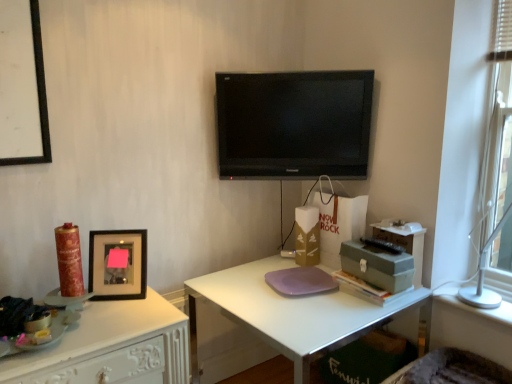
The width and height of the screenshot is (512, 384). What do you see at coordinates (294, 124) in the screenshot?
I see `black glossy flat-screen tv at center` at bounding box center [294, 124].

Image resolution: width=512 pixels, height=384 pixels. What do you see at coordinates (377, 265) in the screenshot? I see `matte green box at right, the second box positioned from the right` at bounding box center [377, 265].

At what (x,y) coordinates should I click in order to perform the action: click on black matte picture frame at upper left. Please return your answer as a coordinate pair (x, y). The width and height of the screenshot is (512, 384). Looking at the image, I should click on (118, 264).

From the picture: Is hardcover book at right thinner than white glossy desk at left, placed as the 2th desk when sorted from right to left?

Yes, hardcover book at right is thinner than white glossy desk at left, placed as the 2th desk when sorted from right to left.

Is hardcover book at right not close to white glossy desk at left, placed as the 2th desk when sorted from right to left?

hardcover book at right is near white glossy desk at left, placed as the 2th desk when sorted from right to left, not far away.

Is hardcover book at right located outside white glossy desk at left, placed as the 2th desk when sorted from right to left?

That's correct, hardcover book at right is outside of white glossy desk at left, placed as the 2th desk when sorted from right to left.

From their relative heights in the image, would you say white matte desk at center, positioned as the 1th desk in right-to-left order, is taller or shorter than fuzzy fabric swivel chair at lower right?

white matte desk at center, positioned as the 1th desk in right-to-left order, is taller than fuzzy fabric swivel chair at lower right.

From a real-world perspective, who is located higher, white matte desk at center, the second desk from the left, or fuzzy fabric swivel chair at lower right?

From a 3D spatial view, fuzzy fabric swivel chair at lower right is above.

Looking at this image, would you consider white matte desk at center, positioned as the 1th desk in right-to-left order, to be distant from fuzzy fabric swivel chair at lower right?

white matte desk at center, positioned as the 1th desk in right-to-left order, is near fuzzy fabric swivel chair at lower right, not far away.

How many degrees apart are the facing directions of black matte picture frame at upper left and hardcover book at right?

The angle between the facing direction of black matte picture frame at upper left and the facing direction of hardcover book at right is 53.7 degrees.

Is black matte picture frame at upper left at the left side of hardcover book at right?

Yes.

From the image's perspective, between black matte picture frame at upper left and hardcover book at right, which one is located above?

From the image's view, black matte picture frame at upper left is above.

Consider the image. From the image's perspective, is transparent glass window screen at right over shiny gold candle at left?

Yes.

In the scene shown: Would you say transparent glass window screen at right is a long distance from shiny gold candle at left?

Yes.

Considering the positions of point (503, 270) and point (69, 226), is point (503, 270) closer or farther from the camera than point (69, 226)?

Point (503, 270) is farther from the camera than point (69, 226).

Which is less distant, (x=423, y=362) or (x=72, y=238)?

The point (x=72, y=238) is closer to the camera.

Considering the relative positions of fuzzy fabric swivel chair at lower right and shiny gold candle at left in the image provided, is fuzzy fabric swivel chair at lower right to the right of shiny gold candle at left from the viewer's perspective?

Correct, you'll find fuzzy fabric swivel chair at lower right to the right of shiny gold candle at left.

Considering the relative sizes of fuzzy fabric swivel chair at lower right and shiny gold candle at left in the image provided, is fuzzy fabric swivel chair at lower right smaller than shiny gold candle at left?

No, fuzzy fabric swivel chair at lower right is not smaller than shiny gold candle at left.

Considering the relative positions of hardcover book at right and fuzzy fabric swivel chair at lower right in the image provided, is hardcover book at right behind fuzzy fabric swivel chair at lower right?

Yes, it is behind fuzzy fabric swivel chair at lower right.

Is there a large distance between hardcover book at right and fuzzy fabric swivel chair at lower right?

That's not correct — hardcover book at right is a little close to fuzzy fabric swivel chair at lower right.

Is hardcover book at right aimed at fuzzy fabric swivel chair at lower right?

No, hardcover book at right is not turned towards fuzzy fabric swivel chair at lower right.

Which object is positioned more to the left, transparent glass window screen at right or black glossy flat-screen tv at center?

From the viewer's perspective, black glossy flat-screen tv at center appears more on the left side.

Is transparent glass window screen at right looking in the opposite direction of black glossy flat-screen tv at center?

No, transparent glass window screen at right is not facing the opposite direction of black glossy flat-screen tv at center.

Who is shorter, transparent glass window screen at right or black glossy flat-screen tv at center?

With less height is black glossy flat-screen tv at center.

From a real-world perspective, relative to black glossy flat-screen tv at center, is transparent glass window screen at right vertically above or below?

transparent glass window screen at right is situated lower than black glossy flat-screen tv at center in the real world.

You are a GUI agent. You are given a task and a screenshot of the screen. Output one action in this format:
    pyautogui.click(x=<x>, y=<y>)
    Task: Click on the 2nd desk in front of the hardcover book at right
    This screenshot has width=512, height=384.
    Given the screenshot: What is the action you would take?
    pyautogui.click(x=109, y=343)

From a real-world perspective, starting from the fuzzy fabric swivel chair at lower right, which desk is the 2nd one below it? Please provide its 2D coordinates.

[(290, 314)]

From the image, which object appears to be farther from matte gray box at right, which ranks as the 2th box in left-to-right order, hardcover book at right or matte green box at right, arranged as the first box when viewed from the left?

hardcover book at right is further to matte gray box at right, which ranks as the 2th box in left-to-right order.

From the image, which object appears to be farther from matte green box at right, arranged as the first box when viewed from the left, white glossy desk at left, placed as the 2th desk when sorted from right to left, or transparent glass window screen at right?

white glossy desk at left, placed as the 2th desk when sorted from right to left, is further to matte green box at right, arranged as the first box when viewed from the left.

When comparing their distances from hardcover book at right, does shiny gold candle at left or matte gray box at right, which ranks as the 2th box in left-to-right order, seem closer?

matte gray box at right, which ranks as the 2th box in left-to-right order.

Estimate the real-world distances between objects in this image. Which object is closer to matte green box at right, the second box positioned from the right, hardcover book at right or shiny gold candle at left?

Among the two, hardcover book at right is located nearer to matte green box at right, the second box positioned from the right.

Looking at the image, which one is located closer to white glossy desk at left, the first desk in the left-to-right sequence, black glossy flat-screen tv at center or matte green box at right, the second box positioned from the right?

Among the two, matte green box at right, the second box positioned from the right, is located nearer to white glossy desk at left, the first desk in the left-to-right sequence.

From the image, which object appears to be farther from matte green box at right, arranged as the first box when viewed from the left, shiny gold candle at left or transparent glass window screen at right?

shiny gold candle at left.

Estimate the real-world distances between objects in this image. Which object is closer to transparent glass window screen at right, matte green box at right, arranged as the first box when viewed from the left, or white glossy desk at left, placed as the 2th desk when sorted from right to left?

Among the two, matte green box at right, arranged as the first box when viewed from the left, is located nearer to transparent glass window screen at right.

Considering their positions, is white matte desk at center, the second desk from the left, positioned further to white glossy desk at left, the first desk in the left-to-right sequence, than matte gray box at right, which is counted as the 1th box, starting from the right?

Based on the image, matte gray box at right, which is counted as the 1th box, starting from the right, appears to be further to white glossy desk at left, the first desk in the left-to-right sequence.

You are a GUI agent. You are given a task and a screenshot of the screen. Output one action in this format:
    pyautogui.click(x=<x>, y=<y>)
    Task: Click on the picture frame between white glossy desk at left, the first desk in the left-to-right sequence, and matte gray box at right, which is counted as the 1th box, starting from the right, in the horizontal direction
    The height and width of the screenshot is (384, 512).
    Given the screenshot: What is the action you would take?
    pyautogui.click(x=118, y=264)

What are the coordinates of `book between white glossy desk at left, placed as the 2th desk when sorted from right to left, and matte gray box at right, which is counted as the 1th box, starting from the right` in the screenshot? It's located at (366, 289).

Where is `window screen between black glossy flat-screen tv at center and fuzzy fabric swivel chair at lower right from top to bottom`? The width and height of the screenshot is (512, 384). window screen between black glossy flat-screen tv at center and fuzzy fabric swivel chair at lower right from top to bottom is located at coordinates (501, 117).

The height and width of the screenshot is (384, 512). I want to click on desk situated between white glossy desk at left, placed as the 2th desk when sorted from right to left, and transparent glass window screen at right from left to right, so click(290, 314).